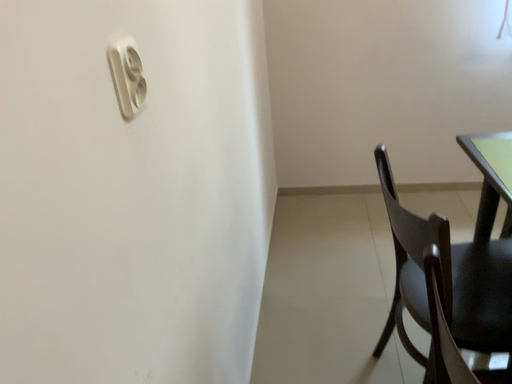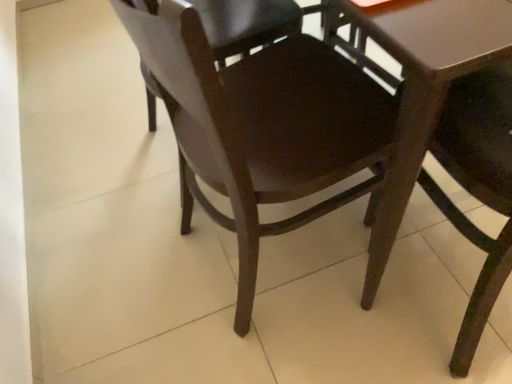
Question: How did the camera likely rotate when shooting the video?

Choices:
 (A) rotated left
 (B) rotated right

Answer: (B)